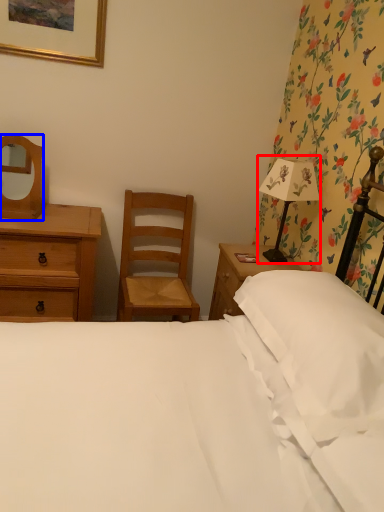
Question: Which object appears closest to the camera in this image, bedside lamp (highlighted by a red box) or mirror (highlighted by a blue box)?

Choices:
 (A) bedside lamp
 (B) mirror

Answer: (A)